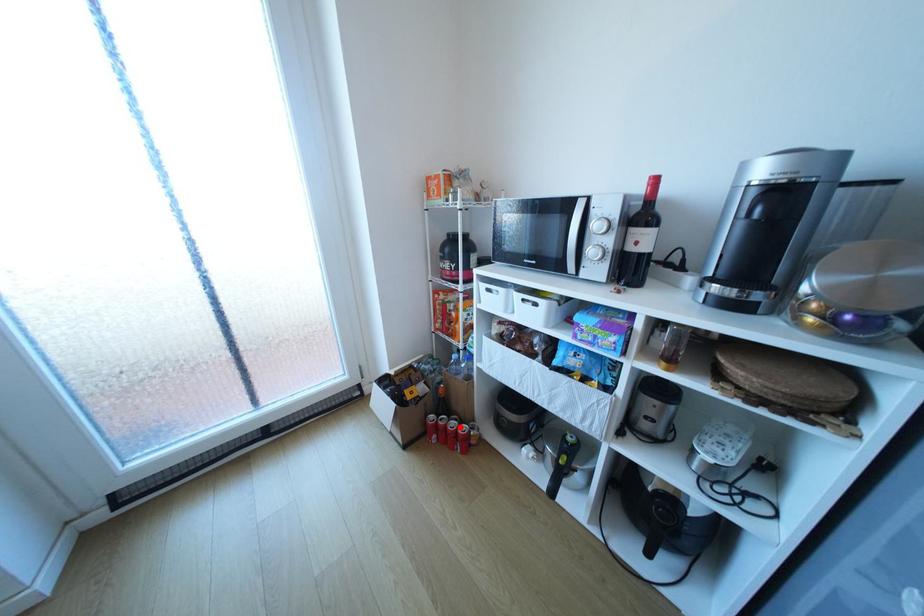
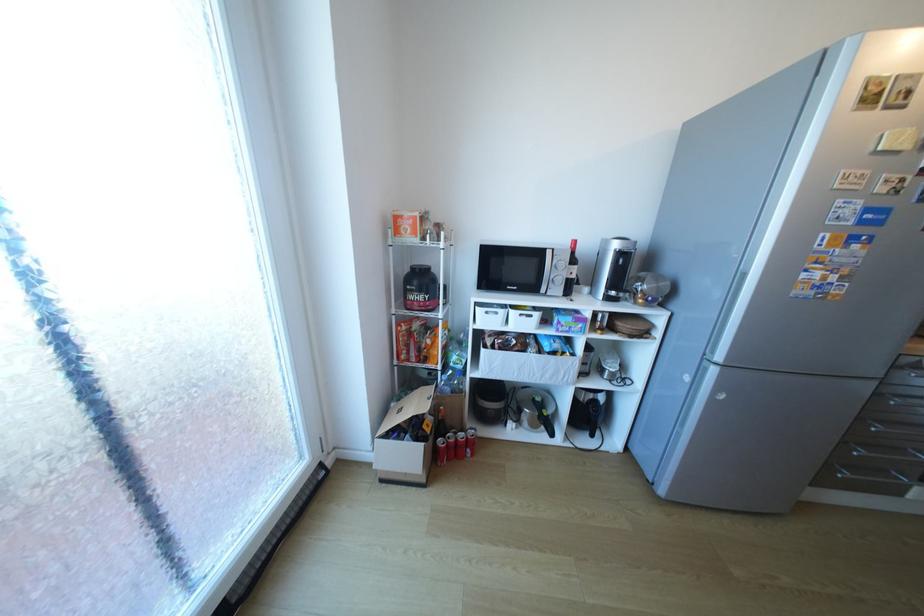
Where in the second image is the point corresponding to the highlighted location from the first image?

(469, 439)